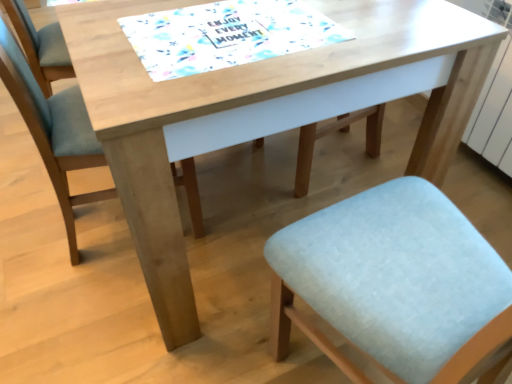
What is the approximate width of light blue fabric chair at lower left?

light blue fabric chair at lower left is 50.24 centimeters wide.

Describe the element at coordinates (54, 130) in the screenshot. I see `light blue fabric chair at lower left` at that location.

The image size is (512, 384). What are the coordinates of `light blue fabric chair at lower left` in the screenshot? It's located at (54, 130).

Describe the element at coordinates (226, 35) in the screenshot. The width and height of the screenshot is (512, 384). I see `white paper placemat at center` at that location.

Find the location of a particular element. This screenshot has width=512, height=384. white paper placemat at center is located at coordinates (226, 35).

Measure the distance between point (241, 40) and camera.

The depth of point (241, 40) is 88.70 centimeters.

Find the location of a particular element. The image size is (512, 384). light blue fabric chair at lower left is located at coordinates (54, 130).

Which object is positioned more to the left, light blue fabric chair at lower left or white paper placemat at center?

light blue fabric chair at lower left is more to the left.

In the image, is light blue fabric chair at lower left positioned in front of or behind white paper placemat at center?

light blue fabric chair at lower left is positioned farther from the viewer than white paper placemat at center.

Is point (41, 151) positioned in front of point (230, 27)?

No, (41, 151) is further to viewer.

From the image's perspective, would you say light blue fabric chair at lower left is positioned over white paper placemat at center?

Incorrect, from the image's perspective, light blue fabric chair at lower left is lower than white paper placemat at center.

From a real-world perspective, between light blue fabric chair at lower left and white paper placemat at center, who is vertically lower?

light blue fabric chair at lower left.

Which of these two, light blue fabric chair at lower left or white paper placemat at center, is thinner?

white paper placemat at center.

Consider the image. Between light blue fabric chair at lower left and white paper placemat at center, which one has more height?

Standing taller between the two is light blue fabric chair at lower left.

Between light blue fabric chair at lower left and white paper placemat at center, which one has larger size?

light blue fabric chair at lower left.

Can white paper placemat at center be found inside light blue fabric chair at lower left?

No.

Is light blue fabric chair at lower left in contact with white paper placemat at center?

No, light blue fabric chair at lower left is not making contact with white paper placemat at center.

Is light blue fabric chair at lower left aimed at white paper placemat at center?

No, light blue fabric chair at lower left is not facing towards white paper placemat at center.

What's the angular difference between light blue fabric chair at lower left and white paper placemat at center's facing directions?

There is a 180-degree angle between the facing directions of light blue fabric chair at lower left and white paper placemat at center.

You are a GUI agent. You are given a task and a screenshot of the screen. Output one action in this format:
    pyautogui.click(x=<x>, y=<y>)
    Task: Click on the place mat above the light blue fabric chair at lower left (from a real-world perspective)
    
    Given the screenshot: What is the action you would take?
    pyautogui.click(x=226, y=35)

Does white paper placemat at center appear on the left side of light blue fabric chair at lower left?

No, white paper placemat at center is not to the left of light blue fabric chair at lower left.

Which object is further away from the camera, white paper placemat at center or light blue fabric chair at lower left?

light blue fabric chair at lower left.

Does point (195, 24) lie in front of point (72, 87)?

Yes, point (195, 24) is in front of point (72, 87).

From the image's perspective, relative to light blue fabric chair at lower left, is white paper placemat at center above or below?

Clearly, from the image's perspective, white paper placemat at center is above light blue fabric chair at lower left.

From a real-world perspective, is white paper placemat at center positioned over light blue fabric chair at lower left based on gravity?

Indeed, from a real-world perspective, white paper placemat at center stands above light blue fabric chair at lower left.

Considering the relative sizes of white paper placemat at center and light blue fabric chair at lower left in the image provided, is white paper placemat at center thinner than light blue fabric chair at lower left?

Yes, white paper placemat at center is thinner than light blue fabric chair at lower left.

Does white paper placemat at center have a greater height compared to light blue fabric chair at lower left?

No.

Who is smaller, white paper placemat at center or light blue fabric chair at lower left?

white paper placemat at center.

Is white paper placemat at center not inside light blue fabric chair at lower left?

Indeed, white paper placemat at center is completely outside light blue fabric chair at lower left.

Are white paper placemat at center and light blue fabric chair at lower left beside each other?

No, white paper placemat at center is not touching light blue fabric chair at lower left.

Could you tell me if white paper placemat at center is facing light blue fabric chair at lower left?

No, white paper placemat at center does not turn towards light blue fabric chair at lower left.

Where is `chair below the white paper placemat at center (from a real-world perspective)`? The image size is (512, 384). chair below the white paper placemat at center (from a real-world perspective) is located at coordinates (54, 130).

Where is `place mat on the right of light blue fabric chair at lower left`? This screenshot has width=512, height=384. place mat on the right of light blue fabric chair at lower left is located at coordinates (226, 35).

Identify the location of chair that appears below the white paper placemat at center (from a real-world perspective). The image size is (512, 384). (54, 130).